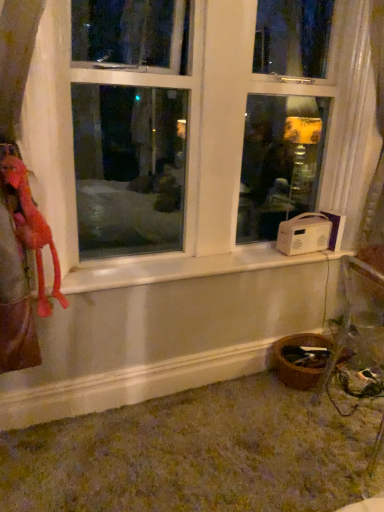
Question: Does point (64, 298) appear closer or farther from the camera than point (228, 184)?

Choices:
 (A) closer
 (B) farther

Answer: (A)

Question: In terms of size, does fluffy pink stuffed animal at left appear bigger or smaller than white plastic window at center?

Choices:
 (A) small
 (B) big

Answer: (A)

Question: Which of these objects is positioned farthest from the white sheer curtain at right?

Choices:
 (A) white plastic window at center
 (B) fluffy pink stuffed animal at left

Answer: (B)

Question: Based on their relative distances, which object is nearer to the white sheer curtain at right?

Choices:
 (A) white plastic window at center
 (B) fluffy pink stuffed animal at left

Answer: (A)